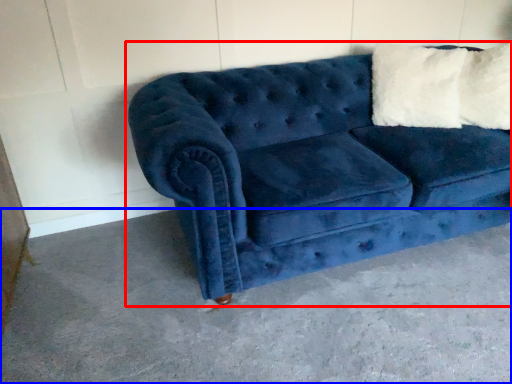
Question: Which point is closer to the camera, studio couch (highlighted by a red box) or concrete (highlighted by a blue box)?

Choices:
 (A) studio couch
 (B) concrete

Answer: (B)